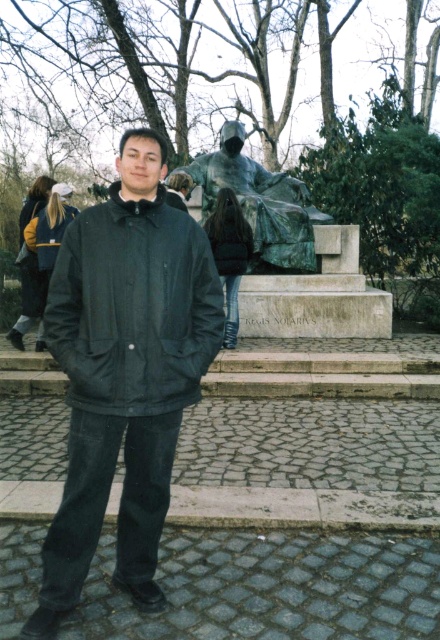
Can you confirm if matte black jacket at center is positioned to the left of bronze statue at center?

Yes, matte black jacket at center is to the left of bronze statue at center.

Measure the distance between matte black jacket at center and bronze statue at center.

matte black jacket at center and bronze statue at center are 6.42 meters apart from each other.

You are a GUI agent. You are given a task and a screenshot of the screen. Output one action in this format:
    pyautogui.click(x=<x>, y=<y>)
    Task: Click on the matte black jacket at center
    
    Given the screenshot: What is the action you would take?
    pyautogui.click(x=124, y=372)

What do you see at coordinates (124, 372) in the screenshot? I see `matte black jacket at center` at bounding box center [124, 372].

Is point (143, 438) in front of point (215, 333)?

Yes, point (143, 438) is in front of point (215, 333).

Who is more distant from viewer, (124, 179) or (124, 298)?

The point (124, 179) is more distant.

What are the coordinates of `matte black jacket at center` in the screenshot? It's located at (124, 372).

Does black matte jacket at center appear under bronze statue at center?

Yes, black matte jacket at center is below bronze statue at center.

Is black matte jacket at center in front of bronze statue at center?

That is True.

Identify the location of black matte jacket at center. The image size is (440, 640). (134, 307).